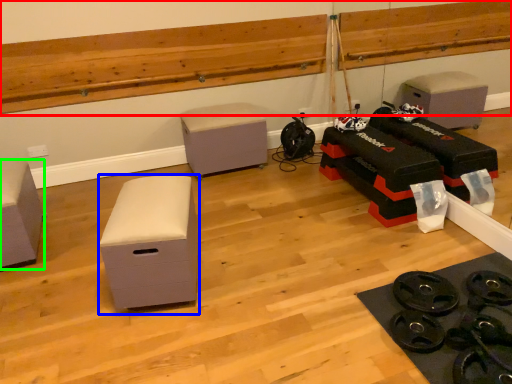
Question: Which object is positioned closest to ledge (highlighted by a red box)? Select from furniture (highlighted by a blue box) and furniture (highlighted by a green box).

Choices:
 (A) furniture
 (B) furniture

Answer: (B)